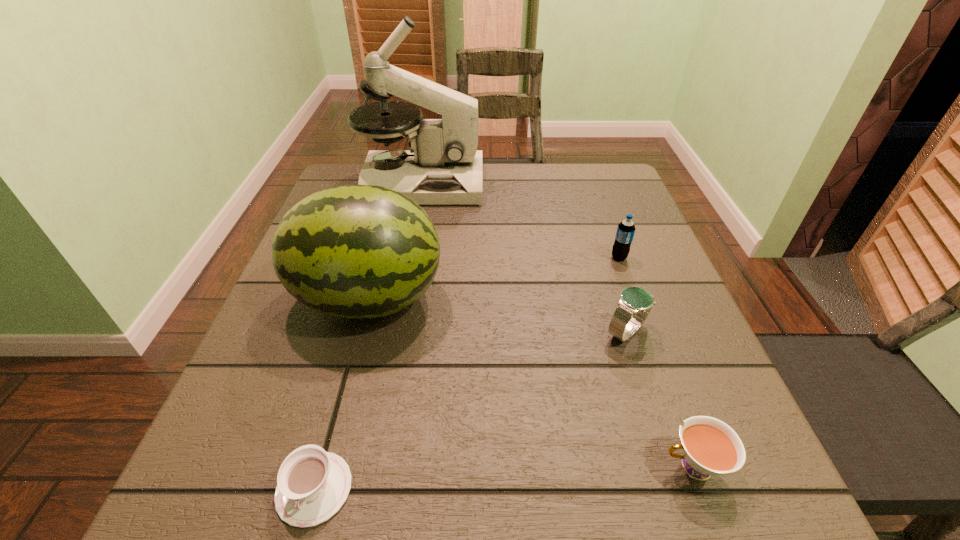
In the image, there is a desktop. Where is `vacant space at the near right corner`? vacant space at the near right corner is located at coordinates (733, 524).

This screenshot has width=960, height=540. Find the location of `free spot between the left teacup and the farthest object`. free spot between the left teacup and the farthest object is located at coordinates (368, 336).

The width and height of the screenshot is (960, 540). I want to click on free space between the watch and the shortest object, so click(x=470, y=410).

Identify the location of free point between the soda bottle and the watermelon. This screenshot has width=960, height=540. (494, 278).

Locate an element on the screen. free space between the fifth shortest object and the shorter teacup is located at coordinates (342, 394).

In order to click on blank region between the left teacup and the second tallest object in this screenshot , I will do `click(342, 394)`.

Where is `unoccupied position between the left teacup and the watermelon`? The width and height of the screenshot is (960, 540). unoccupied position between the left teacup and the watermelon is located at coordinates (342, 394).

At what (x,y) coordinates should I click in order to perform the action: click on vacant region between the fifth tallest object and the second tallest object. Please return your answer as a coordinate pair (x, y). The width and height of the screenshot is (960, 540). Looking at the image, I should click on (531, 383).

Where is `empty location between the shortest object and the watermelon`? This screenshot has height=540, width=960. empty location between the shortest object and the watermelon is located at coordinates (342, 394).

Locate an element on the screen. This screenshot has height=540, width=960. vacant space that is in between the left teacup and the watermelon is located at coordinates (342, 394).